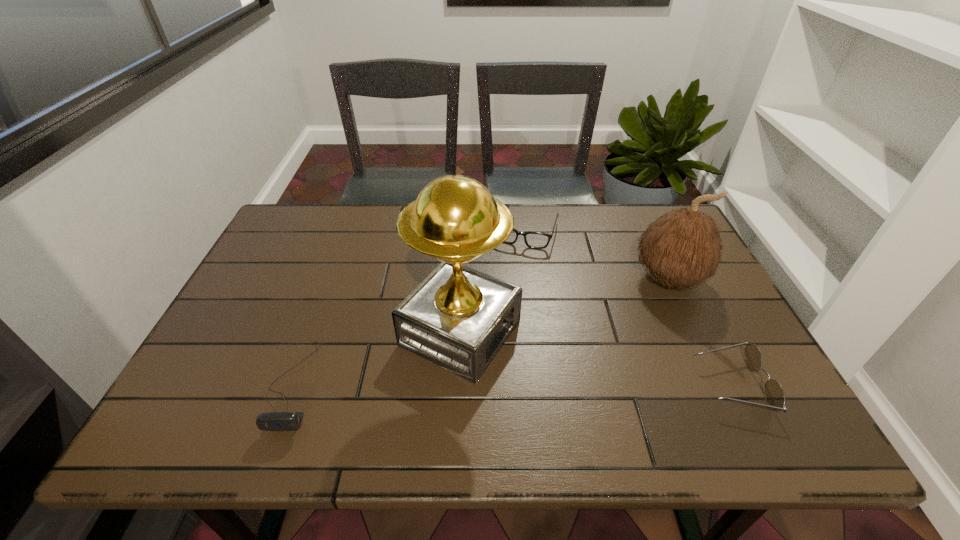
The image size is (960, 540). Find the location of `vacant region at the near right corner of the desktop`. vacant region at the near right corner of the desktop is located at coordinates coord(755,375).

Locate an element on the screen. Image resolution: width=960 pixels, height=540 pixels. vacant space that is in between the webcam and the award is located at coordinates (377, 359).

Find the location of `free space between the fourth shortest object and the nearer spectacles`. free space between the fourth shortest object and the nearer spectacles is located at coordinates (701, 332).

Locate an element on the screen. This screenshot has width=960, height=540. empty space that is in between the right spectacles and the leftmost object is located at coordinates (514, 385).

The width and height of the screenshot is (960, 540). Identify the location of free point between the award and the right spectacles. (596, 359).

At what (x,y) coordinates should I click in order to perform the action: click on free space between the webcam and the nearer spectacles. Please return your answer as a coordinate pair (x, y). Looking at the image, I should click on (514, 385).

The width and height of the screenshot is (960, 540). Identify the location of vacant space that's between the nearer spectacles and the tallest object. (596, 359).

Find the location of `free area in between the leftmost object and the tallest object`. free area in between the leftmost object and the tallest object is located at coordinates (377, 359).

Locate an element on the screen. The width and height of the screenshot is (960, 540). empty space between the right spectacles and the award is located at coordinates (596, 359).

Where is `object that is the third closest one to the nearer spectacles`? This screenshot has height=540, width=960. object that is the third closest one to the nearer spectacles is located at coordinates (536, 240).